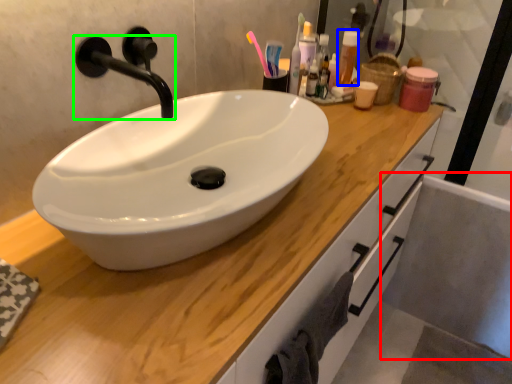
Question: Considering the real-world distances, which object is closest to bath (highlighted by a red box)? toiletry (highlighted by a blue box) or tap (highlighted by a green box).

Choices:
 (A) toiletry
 (B) tap

Answer: (A)